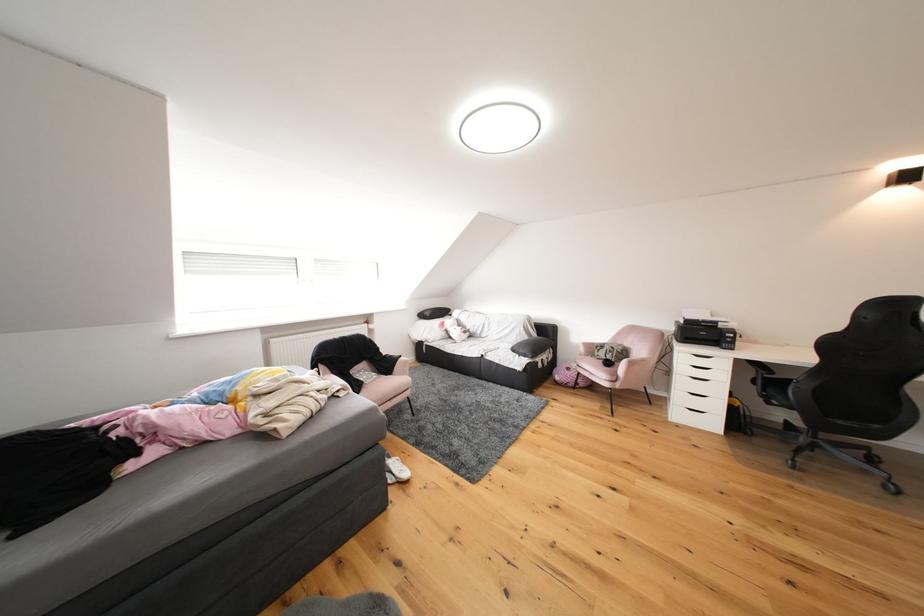
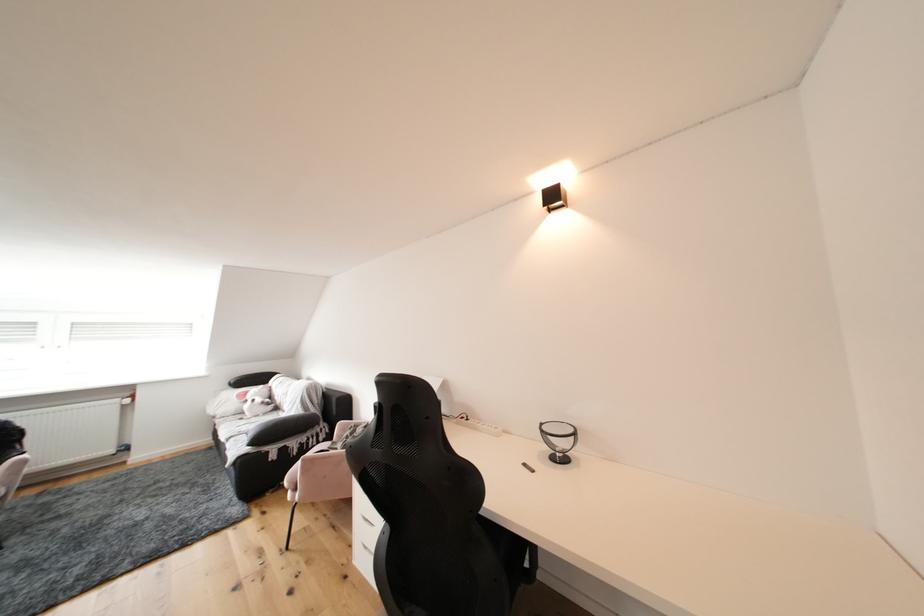
Question: The images are taken continuously from a first-person perspective. In which direction are you moving?

Choices:
 (A) Left
 (B) Right
 (C) Forward
 (D) Backward

Answer: (B)